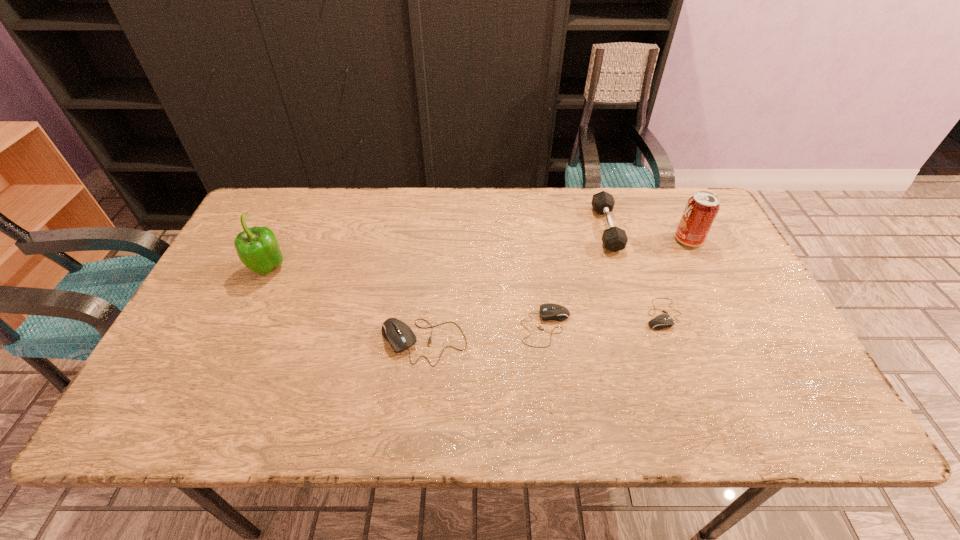
Where is `vacant area between the leftmost object and the second object from left to right`? vacant area between the leftmost object and the second object from left to right is located at coordinates (346, 306).

Locate an element on the screen. vacant area that lies between the third farthest object and the second tallest object is located at coordinates pos(479,255).

Where is `empty location between the third shortest object and the shortest computer mouse`? Image resolution: width=960 pixels, height=540 pixels. empty location between the third shortest object and the shortest computer mouse is located at coordinates (543, 328).

Locate an element on the screen. vacant region between the fourth shortest object and the second tallest object is located at coordinates (648, 234).

Locate an element on the screen. The width and height of the screenshot is (960, 540). empty space that is in between the third shortest object and the bell pepper is located at coordinates (346, 306).

Where is `free space between the bell pepper and the rightmost object`? free space between the bell pepper and the rightmost object is located at coordinates (479, 255).

Locate an element on the screen. The image size is (960, 540). vacant area between the bell pepper and the dumbbell is located at coordinates pos(438,249).

You are a GUI agent. You are given a task and a screenshot of the screen. Output one action in this format:
    pyautogui.click(x=<x>, y=<y>)
    Task: Click on the free space between the rightmost computer mouse and the leftmost object
    
    Given the screenshot: What is the action you would take?
    pyautogui.click(x=466, y=292)

Select which object appears as the fourth closest to the second shortest object. Please provide its 2D coordinates. Your answer should be formatted as a tuple, i.e. [(x, y)], where the tuple contains the x and y coordinates of a point satisfying the conditions above.

[(700, 212)]

Image resolution: width=960 pixels, height=540 pixels. I want to click on object that stands as the fifth closest to the fifth shortest object, so click(257, 247).